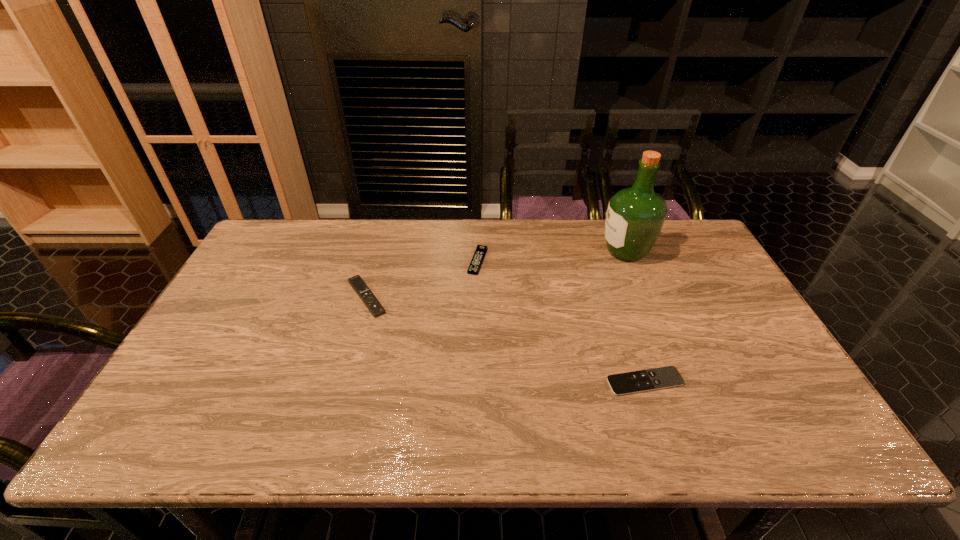
At what (x,y) coordinates should I click in order to perform the action: click on the second closest object relative to the second nearest remote control. Please return your answer as a coordinate pair (x, y). The height and width of the screenshot is (540, 960). Looking at the image, I should click on (663, 377).

Locate an element on the screen. Image resolution: width=960 pixels, height=540 pixels. object that ranks as the second closest to the second tallest remote control is located at coordinates (635, 216).

Where is `the closest remote control relative to the tallest remote control`? The width and height of the screenshot is (960, 540). the closest remote control relative to the tallest remote control is located at coordinates (475, 264).

Find the location of a particular element. This screenshot has width=960, height=540. the closest remote control relative to the third object from right to left is located at coordinates (357, 283).

Image resolution: width=960 pixels, height=540 pixels. I want to click on blank area in the image that satisfies the following two spatial constraints: 1. on the front side of the shortest remote control; 2. on the right side of the leftmost remote control, so click(x=343, y=382).